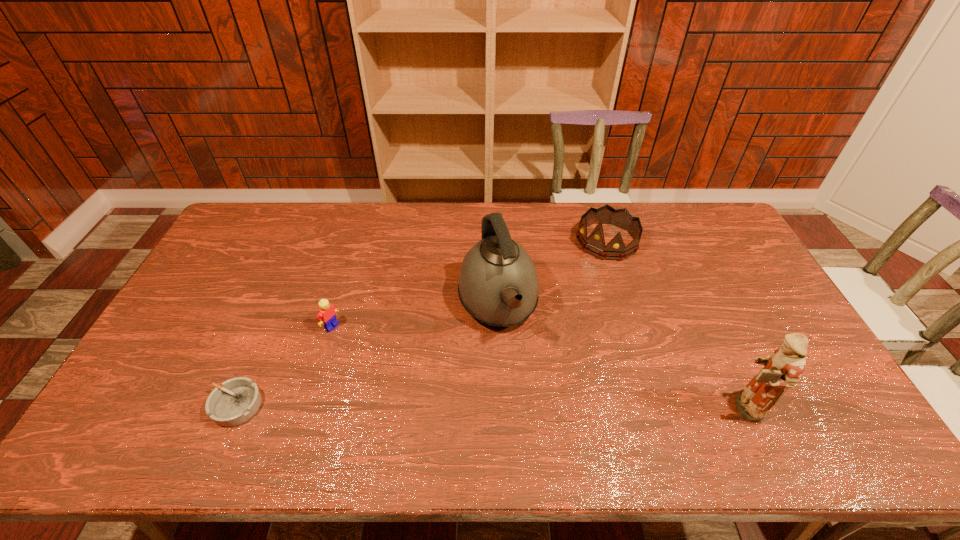
Identify the location of empty location between the ashtray and the Lego. point(284,366).

At what (x,y) coordinates should I click in order to perform the action: click on vacant space that is in between the ashtray and the third object from right to left. Please return your answer as a coordinate pair (x, y). The width and height of the screenshot is (960, 540). Looking at the image, I should click on (367, 355).

The width and height of the screenshot is (960, 540). In order to click on free space between the rightmost object and the second object from left to right in this screenshot , I will do `click(537, 366)`.

Where is `free spot between the farthest object and the shortest object`? The width and height of the screenshot is (960, 540). free spot between the farthest object and the shortest object is located at coordinates (421, 323).

Where is `free space between the kettle and the second object from left to right`? The width and height of the screenshot is (960, 540). free space between the kettle and the second object from left to right is located at coordinates 415,316.

Find the location of a particular element. Image resolution: width=960 pixels, height=540 pixels. free area in between the shortest object and the figurine is located at coordinates (489, 406).

At what (x,y) coordinates should I click in order to perform the action: click on the closest object to the leftmost object. Please return your answer as a coordinate pair (x, y). The width and height of the screenshot is (960, 540). Looking at the image, I should click on (327, 313).

You are a GUI agent. You are given a task and a screenshot of the screen. Output one action in this format:
    pyautogui.click(x=<x>, y=<y>)
    Task: Click on the object identified as the third closest to the Lego
    This screenshot has width=960, height=540.
    Given the screenshot: What is the action you would take?
    pyautogui.click(x=595, y=243)

Where is `vacant space that satisfies the following two spatial constraints: 1. on the front side of the figurine; 2. on the front-facing side of the fourth object from right to left`? The width and height of the screenshot is (960, 540). vacant space that satisfies the following two spatial constraints: 1. on the front side of the figurine; 2. on the front-facing side of the fourth object from right to left is located at coordinates (307, 407).

Locate an element on the screen. vacant region that satisfies the following two spatial constraints: 1. on the front side of the rightmost object; 2. on the front-facing side of the kettle is located at coordinates [501, 407].